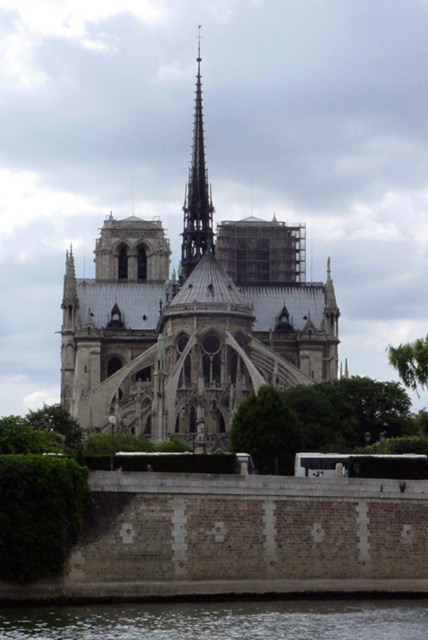
Based on the photo, is dark gray water at lower center in front of smooth gray spire at center?

Yes.

I want to click on dark gray water at lower center, so click(222, 620).

Is stone gothic cathedral at center thinner than dark gray water at lower center?

In fact, stone gothic cathedral at center might be wider than dark gray water at lower center.

Is point (104, 394) positioned behind point (103, 627)?

Yes.

Describe the element at coordinates (192, 320) in the screenshot. The image size is (428, 640). I see `stone gothic cathedral at center` at that location.

You are a GUI agent. You are given a task and a screenshot of the screen. Output one action in this format:
    pyautogui.click(x=<x>, y=<y>)
    Task: Click on the stone gothic cathedral at center
    The width and height of the screenshot is (428, 640).
    Given the screenshot: What is the action you would take?
    pyautogui.click(x=192, y=320)

Is dark gray water at lower center thinner than green leafy tree at center?

In fact, dark gray water at lower center might be wider than green leafy tree at center.

Does dark gray water at lower center appear under green leafy tree at center?

Yes, dark gray water at lower center is below green leafy tree at center.

At what (x,y) coordinates should I click in order to perform the action: click on dark gray water at lower center. Please return your answer as a coordinate pair (x, y). This screenshot has height=640, width=428. Looking at the image, I should click on (222, 620).

Image resolution: width=428 pixels, height=640 pixels. What are the coordinates of `dark gray water at lower center` in the screenshot? It's located at (222, 620).